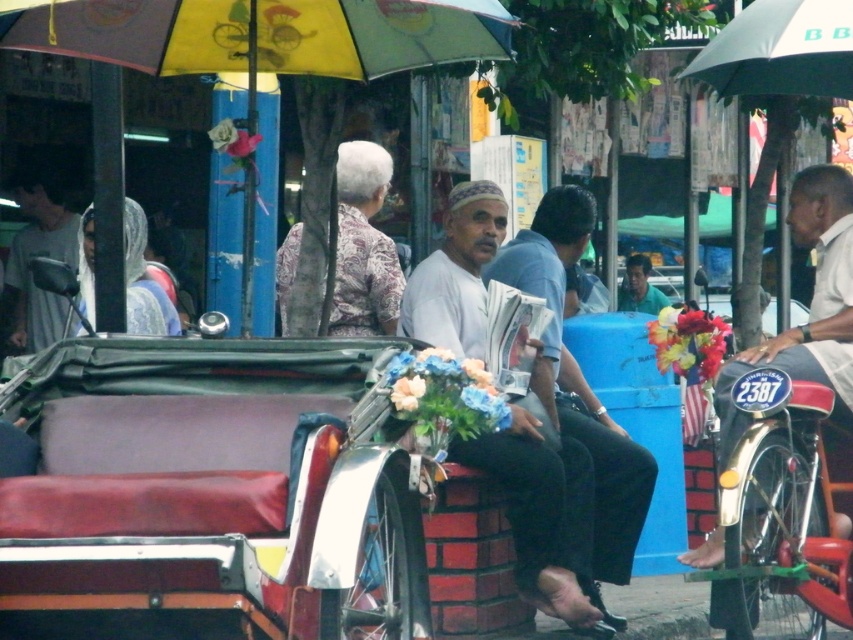
Question: Which of the following is the closest to the observer?

Choices:
 (A) metallic silver coach at right
 (B) green fabric umbrella at upper right

Answer: (A)

Question: Can you confirm if metallic silver coach at right is positioned below matte gray shirt at left?

Choices:
 (A) yes
 (B) no

Answer: (A)

Question: Which object is the farthest from the green fabric shirt at center?

Choices:
 (A) metallic silver coach at right
 (B) green fabric umbrella at upper right

Answer: (A)

Question: Which of the following is the closest to the observer?

Choices:
 (A) green fabric shirt at center
 (B) metallic silver coach at right
 (C) matte gray shirt at left
 (D) metallic red tricycle at lower right

Answer: (D)

Question: Is light gray cotton shirt at center above patterned fabric headscarf at center?

Choices:
 (A) yes
 (B) no

Answer: (B)

Question: Can you confirm if green fabric umbrella at upper right is positioned to the left of green fabric shirt at center?

Choices:
 (A) yes
 (B) no

Answer: (A)